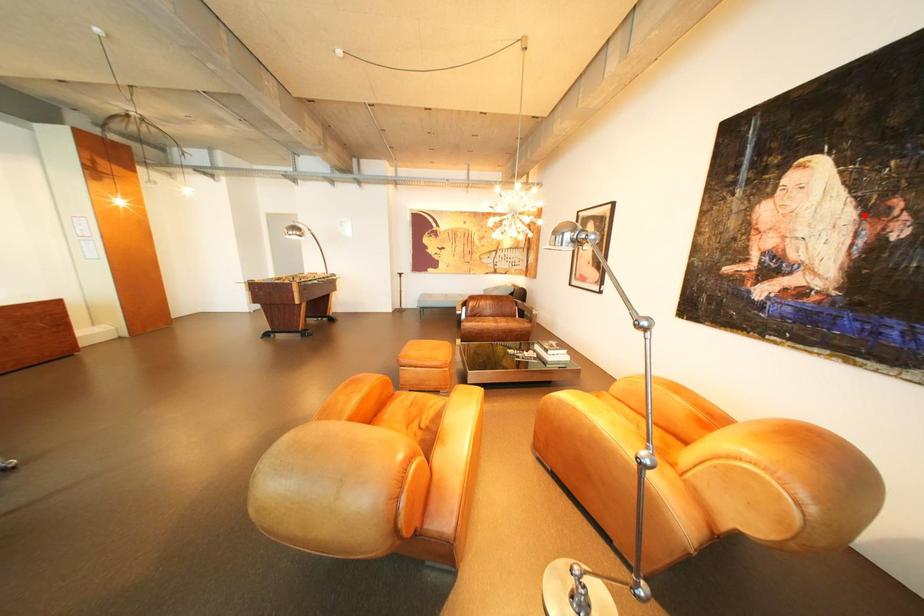
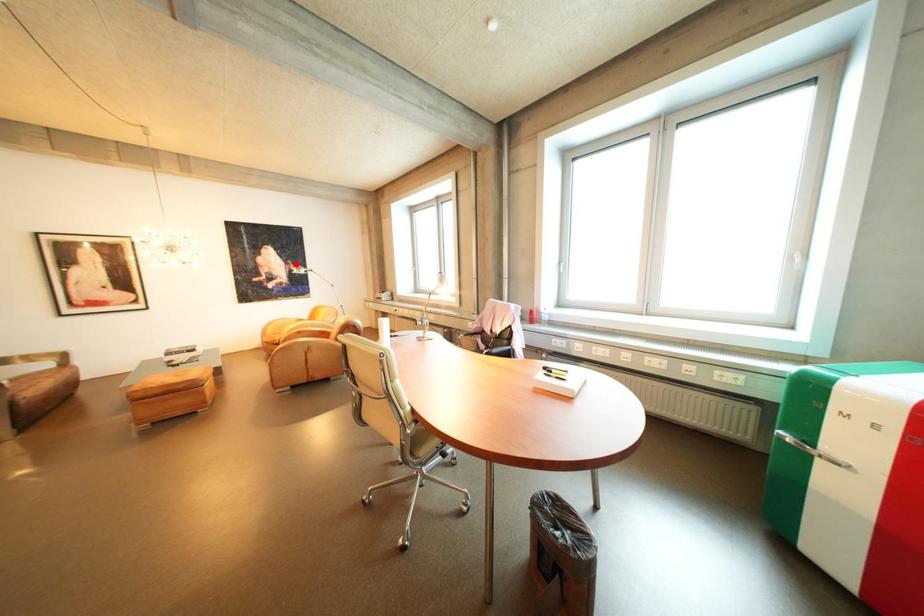
I am providing you with two images of the same scene from different viewpoints. A red point is marked on the first image and another point is marked on the second image. Are the points marked in image1 and image2 representing the same 3D position?

Yes